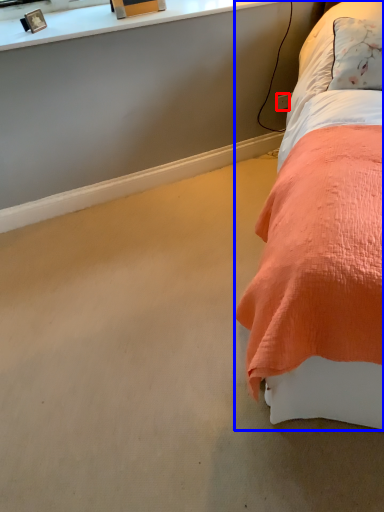
Question: Among these objects, which one is farthest to the camera, power outlet (highlighted by a red box) or bed (highlighted by a blue box)?

Choices:
 (A) power outlet
 (B) bed

Answer: (A)